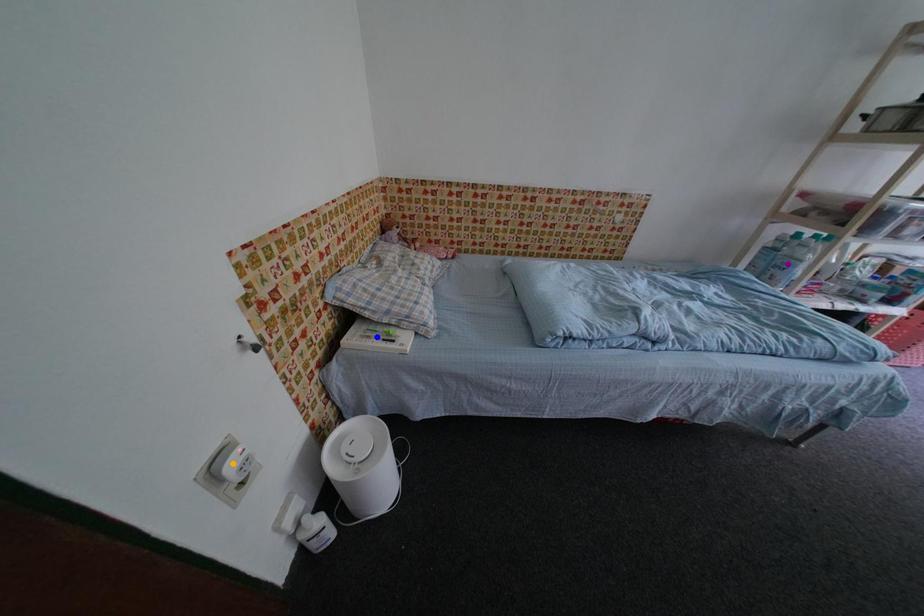
Order these from nearest to farthest:
purple point, blue point, orange point

purple point < blue point < orange point